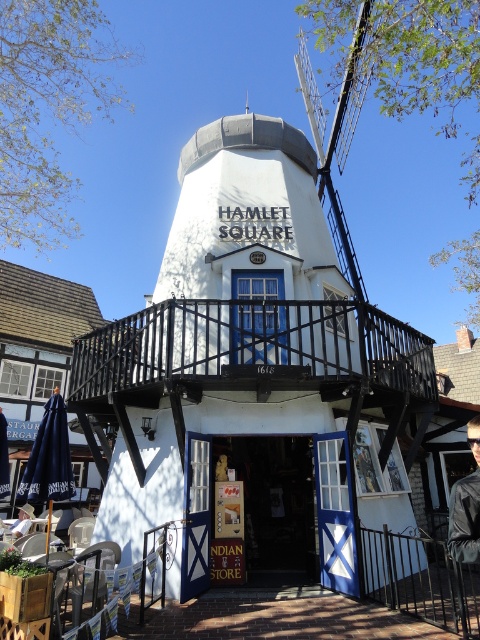
Who is shorter, white painted wood windmill at center or black metal railing at lower right?

black metal railing at lower right is shorter.

Does white painted wood windmill at center appear on the left side of black metal railing at lower right?

Correct, you'll find white painted wood windmill at center to the left of black metal railing at lower right.

Measure the distance between white painted wood windmill at center and camera.

white painted wood windmill at center is 5.73 meters from camera.

The height and width of the screenshot is (640, 480). What are the coordinates of `white painted wood windmill at center` in the screenshot? It's located at (253, 376).